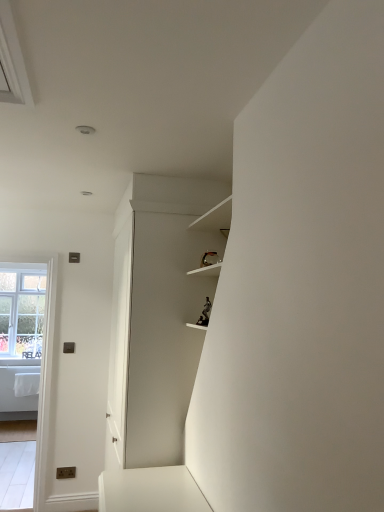
Question: Is clear glass window at left inside clear glass window at left?

Choices:
 (A) no
 (B) yes

Answer: (A)

Question: Considering the relative positions of clear glass window at left and clear glass window at left in the image provided, is clear glass window at left in front of clear glass window at left?

Choices:
 (A) yes
 (B) no

Answer: (A)

Question: Does clear glass window at left turn towards clear glass window at left?

Choices:
 (A) yes
 (B) no

Answer: (B)

Question: Can you confirm if clear glass window at left is smaller than clear glass window at left?

Choices:
 (A) no
 (B) yes

Answer: (B)

Question: Is clear glass window at left looking in the opposite direction of clear glass window at left?

Choices:
 (A) yes
 (B) no

Answer: (A)

Question: From the image's perspective, does clear glass window at left appear higher than clear glass window at left?

Choices:
 (A) yes
 (B) no

Answer: (B)

Question: Is clear glass window at left bigger than white matte cabinet at center?

Choices:
 (A) yes
 (B) no

Answer: (B)

Question: From a real-world perspective, is clear glass window at left on white matte cabinet at center?

Choices:
 (A) yes
 (B) no

Answer: (B)

Question: Can you confirm if clear glass window at left is smaller than white matte cabinet at center?

Choices:
 (A) yes
 (B) no

Answer: (A)

Question: Can you confirm if clear glass window at left is positioned to the left of white matte cabinet at center?

Choices:
 (A) no
 (B) yes

Answer: (B)

Question: Is clear glass window at left directly adjacent to white matte cabinet at center?

Choices:
 (A) yes
 (B) no

Answer: (B)

Question: Is clear glass window at left further to the viewer compared to white matte cabinet at center?

Choices:
 (A) no
 (B) yes

Answer: (B)

Question: Is white matte cabinet at center completely or partially inside clear glass window at left?

Choices:
 (A) yes
 (B) no

Answer: (B)